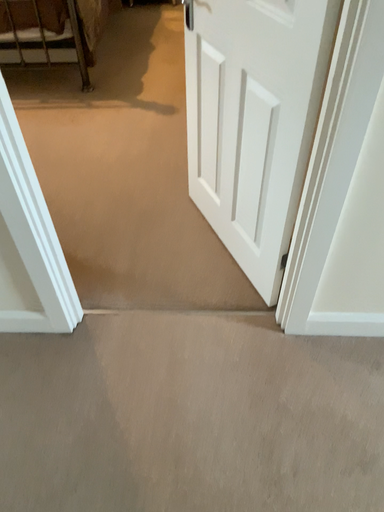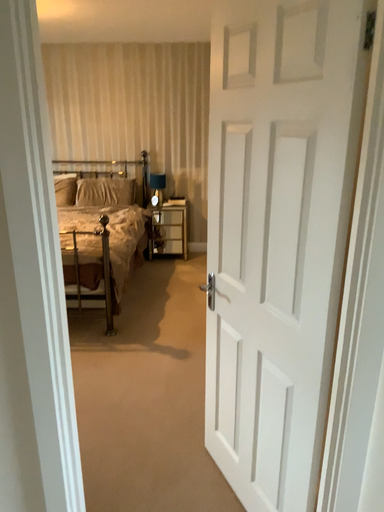
Question: How did the camera likely rotate when shooting the video?

Choices:
 (A) rotated upward
 (B) rotated downward

Answer: (A)